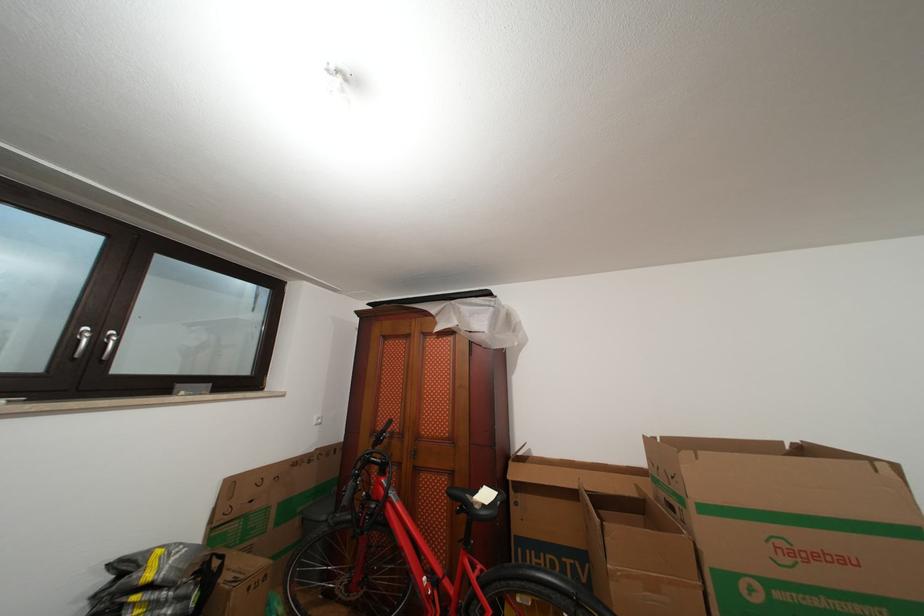
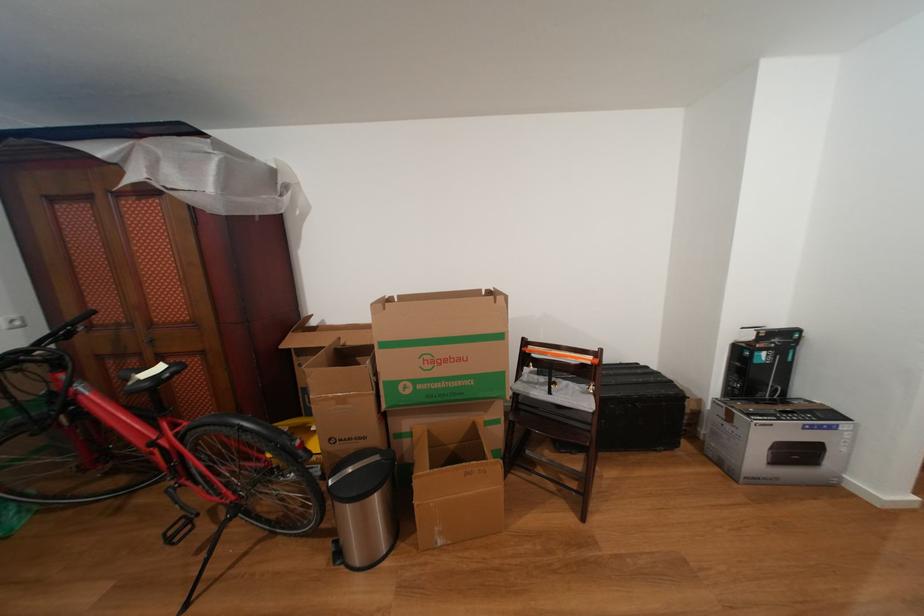
Based on the continuous images, in which direction is the camera rotating?

→ The camera rotated toward right-down.